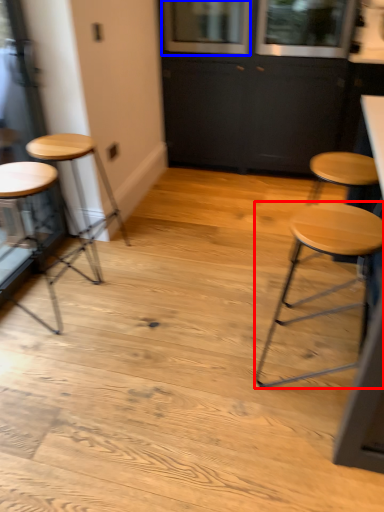
Question: Which point is further to the camera, stool (highlighted by a red box) or window (highlighted by a blue box)?

Choices:
 (A) stool
 (B) window

Answer: (B)